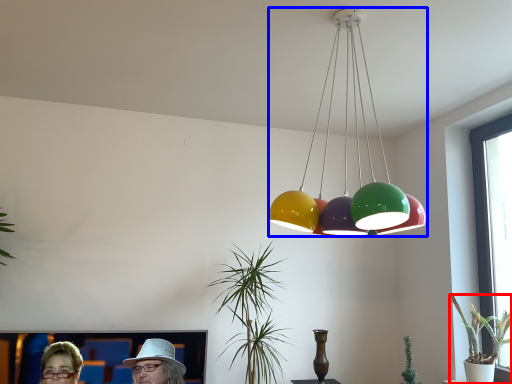
Question: Among these objects, which one is farthest to the camera, houseplant (highlighted by a red box) or lamp (highlighted by a blue box)?

Choices:
 (A) houseplant
 (B) lamp

Answer: (A)